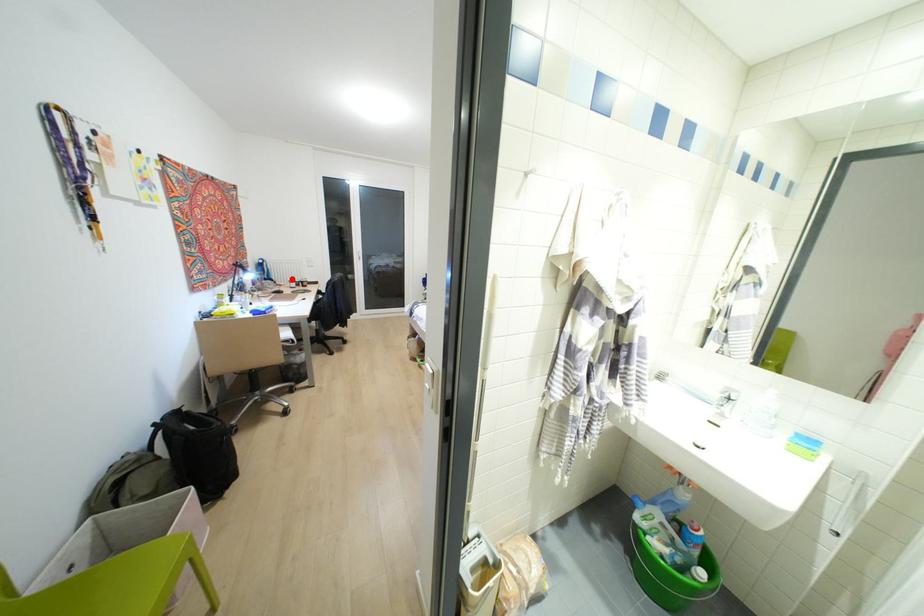
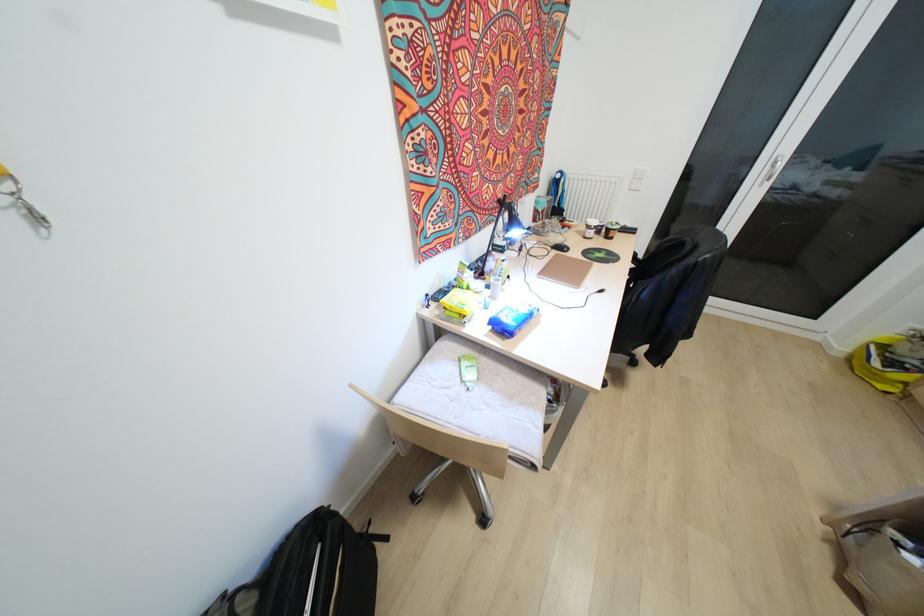
Locate, in the second image, the point that corresponds to the highlighted location in the first image.

(592, 222)